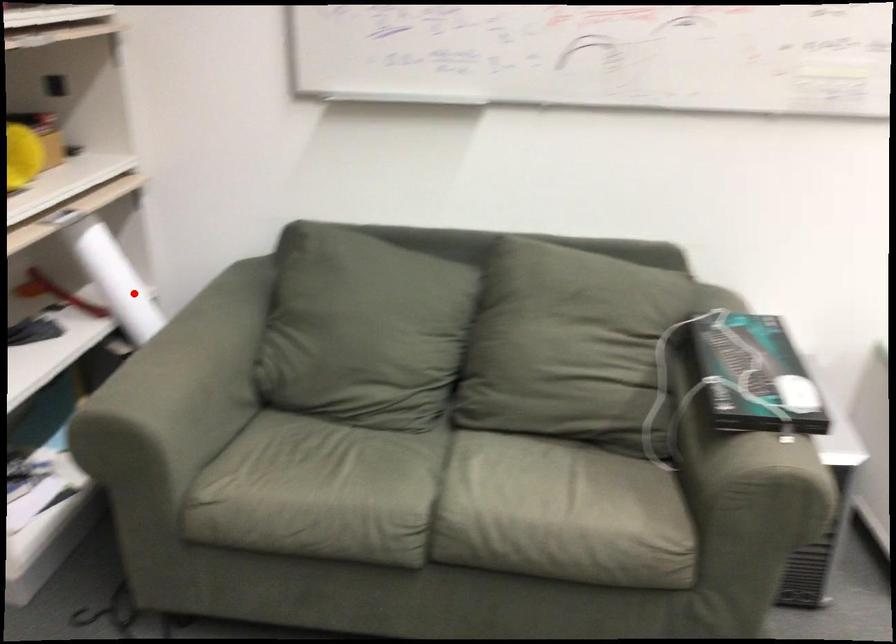
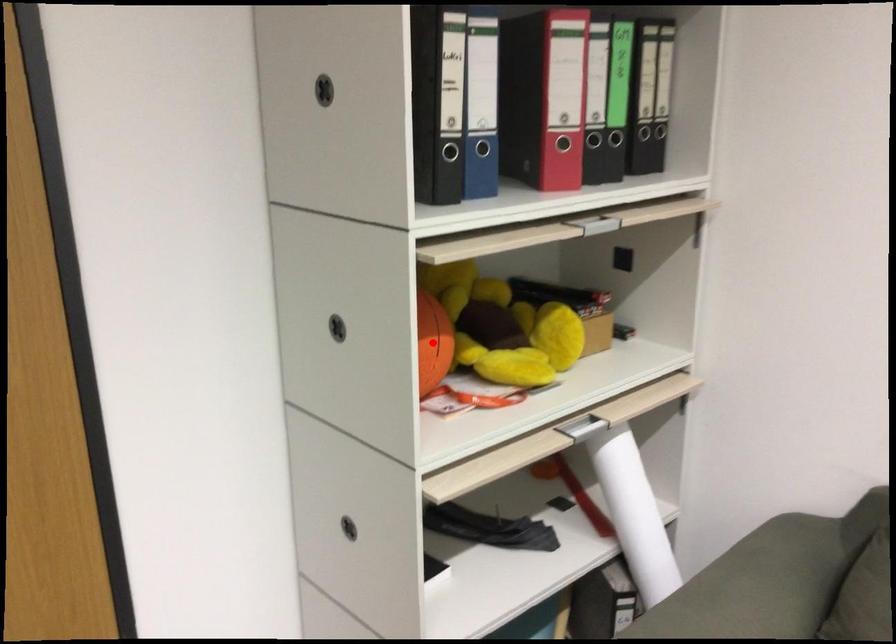
I am providing you with two images of the same scene from different viewpoints. A red point is marked on the first image and another point is marked on the second image. Does the point marked in image1 correspond to the same location as the one in image2?

No